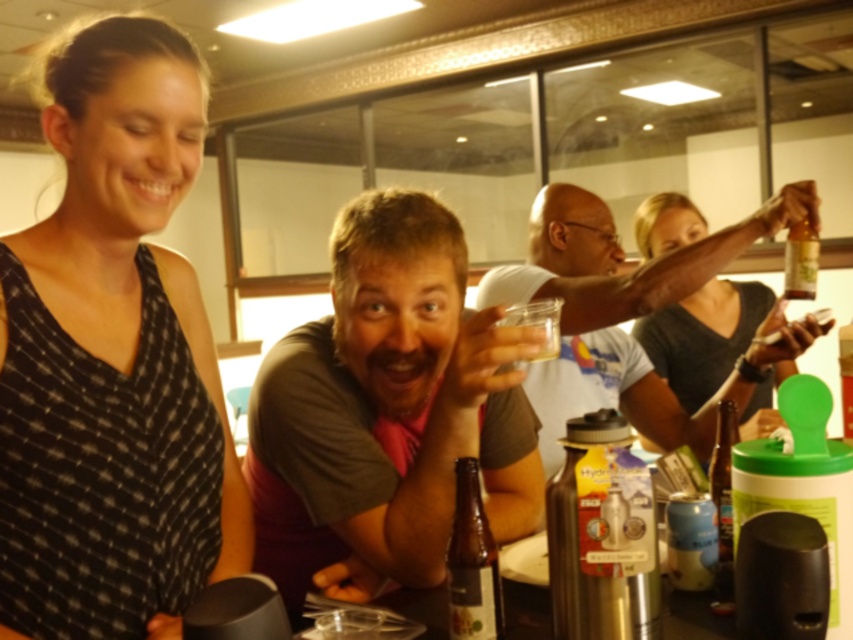
You are a bartender preparing to place a brown glass bottle at lower center on a shelf next to a brown cotton shirt at center. The shelf has limited space. Can you determine which item requires more horizontal space based on their widths?

The brown cotton shirt at center requires more horizontal space because its width is larger than the brown glass bottle at lower center.

You are a bartender at this bar and need to deliver a drink to the person wearing the brown cotton shirt at center. The shortest path to them requires passing through a narrow corridor between two tables. The corridor is 33.45 inches wide. Can you carry a tray that is 32 inches wide through this corridor?

The corridor between the two tables is 33.45 inches wide, so yes, the bartender can carry a tray that is 32 inches wide through the corridor since it is slightly narrower than the corridor width.